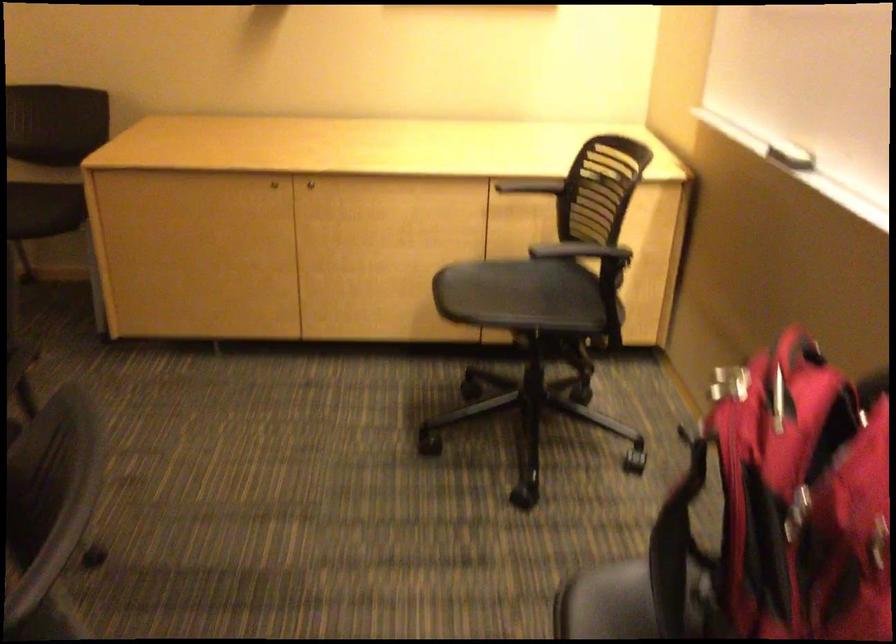
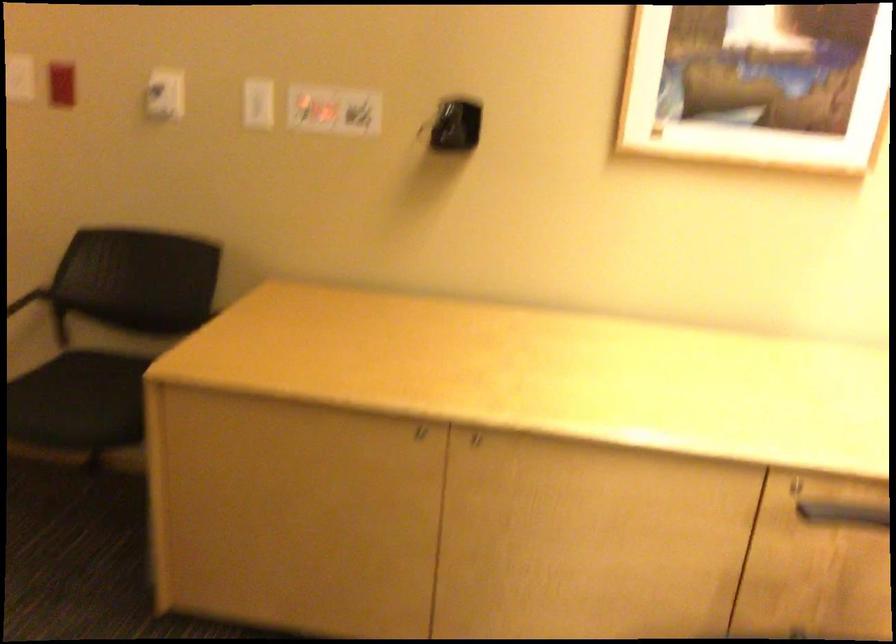
Question: The images are taken continuously from a first-person perspective. In which direction is your viewpoint rotating?

Choices:
 (A) Left
 (B) Right
 (C) Up
 (D) Down

Answer: (A)